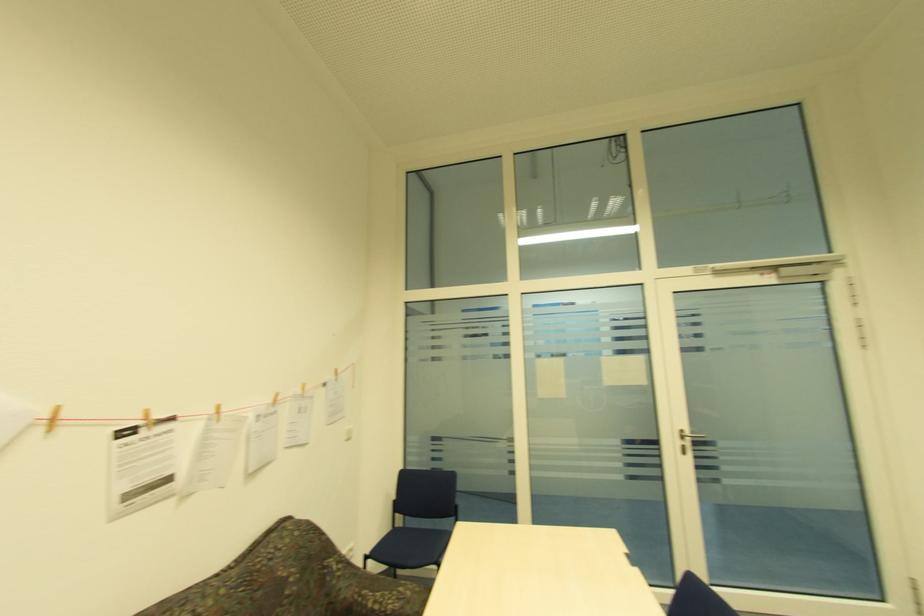
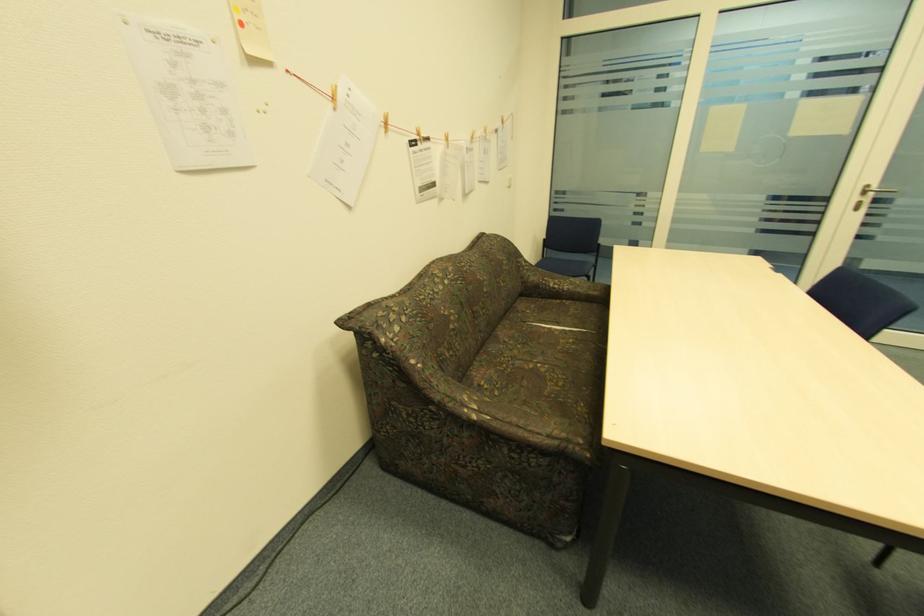
In the second image, find the point that corresponds to pixel 682 444 in the first image.

(859, 199)